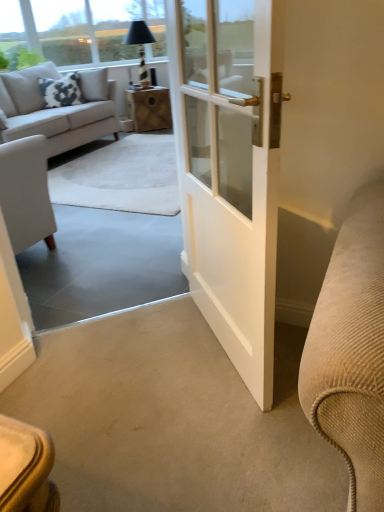
Question: Does transparent glass window screen at upper left have a lesser height compared to wooden box at center?

Choices:
 (A) yes
 (B) no

Answer: (B)

Question: Is transparent glass window screen at upper left thinner than wooden box at center?

Choices:
 (A) no
 (B) yes

Answer: (B)

Question: Is there a large distance between transparent glass window screen at upper left and wooden box at center?

Choices:
 (A) yes
 (B) no

Answer: (B)

Question: Is the depth of transparent glass window screen at upper left greater than that of wooden box at center?

Choices:
 (A) no
 (B) yes

Answer: (A)

Question: Is transparent glass window screen at upper left facing away from wooden box at center?

Choices:
 (A) yes
 (B) no

Answer: (B)

Question: From the image's perspective, is light gray fabric couch at upper left above or below black glass lamp at upper center?

Choices:
 (A) above
 (B) below

Answer: (B)

Question: Choose the correct answer: Is light gray fabric couch at upper left inside black glass lamp at upper center or outside it?

Choices:
 (A) inside
 (B) outside

Answer: (B)

Question: Considering the positions of light gray fabric couch at upper left and black glass lamp at upper center in the image, is light gray fabric couch at upper left wider or thinner than black glass lamp at upper center?

Choices:
 (A) wide
 (B) thin

Answer: (A)

Question: From a real-world perspective, relative to black glass lamp at upper center, is light gray fabric couch at upper left vertically above or below?

Choices:
 (A) above
 (B) below

Answer: (B)

Question: Is transparent glass window screen at upper left inside or outside of wooden box at center?

Choices:
 (A) outside
 (B) inside

Answer: (A)

Question: Considering the positions of transparent glass window screen at upper left and wooden box at center in the image, is transparent glass window screen at upper left wider or thinner than wooden box at center?

Choices:
 (A) wide
 (B) thin

Answer: (B)

Question: Is transparent glass window screen at upper left bigger or smaller than wooden box at center?

Choices:
 (A) small
 (B) big

Answer: (B)

Question: From their relative heights in the image, would you say transparent glass window screen at upper left is taller or shorter than wooden box at center?

Choices:
 (A) tall
 (B) short

Answer: (A)

Question: Visually, is black glass lamp at upper center positioned to the left or to the right of transparent glass window screen at upper left?

Choices:
 (A) left
 (B) right

Answer: (B)

Question: Considering the positions of black glass lamp at upper center and transparent glass window screen at upper left in the image, is black glass lamp at upper center bigger or smaller than transparent glass window screen at upper left?

Choices:
 (A) big
 (B) small

Answer: (A)